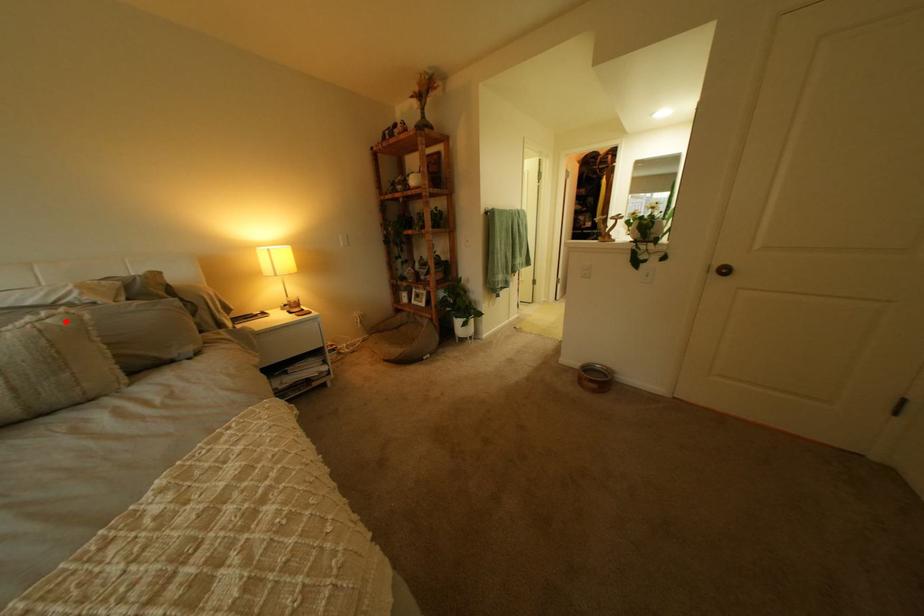
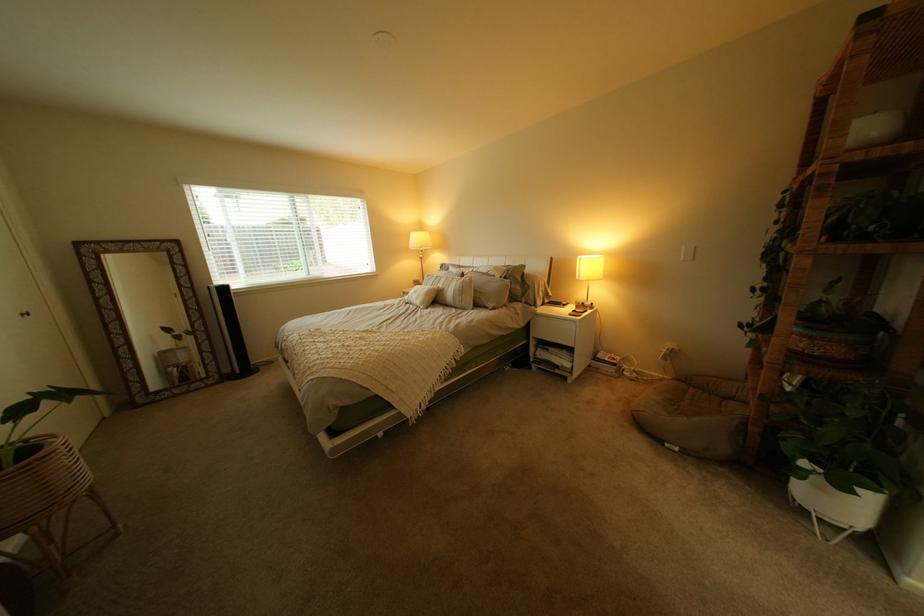
In the second image, find the point that corresponds to the highlighted location in the first image.

(482, 280)